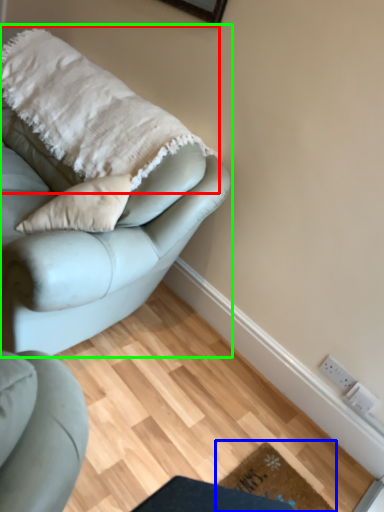
Question: Which object is positioned closest to blanket (highlighted by a red box)? Select from doormat (highlighted by a blue box) and studio couch (highlighted by a green box).

Choices:
 (A) doormat
 (B) studio couch

Answer: (B)